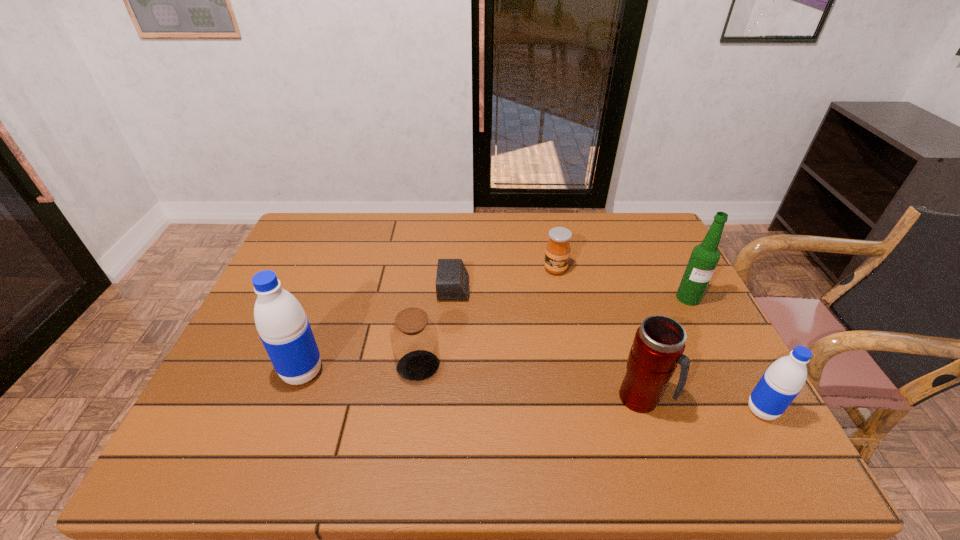
The width and height of the screenshot is (960, 540). What are the coordinates of `the left water bottle` in the screenshot? It's located at (284, 329).

Where is `the leftmost object`? Image resolution: width=960 pixels, height=540 pixels. the leftmost object is located at coordinates point(284,329).

This screenshot has width=960, height=540. Identify the location of the shorter water bottle. (780, 384).

Image resolution: width=960 pixels, height=540 pixels. I want to click on the nearer water bottle, so click(780, 384).

The width and height of the screenshot is (960, 540). What are the coordinates of `alarm clock` in the screenshot? It's located at (452, 280).

Where is `the sixth tallest object`? Image resolution: width=960 pixels, height=540 pixels. the sixth tallest object is located at coordinates (557, 253).

You are a GUI agent. You are given a task and a screenshot of the screen. Output one action in this format:
    pyautogui.click(x=<x>, y=<y>)
    Task: Click on the fourth object from right to left
    
    Given the screenshot: What is the action you would take?
    pyautogui.click(x=557, y=253)

I want to click on beer bottle, so click(x=704, y=258).

Identify the location of thermos bottle. Image resolution: width=960 pixels, height=540 pixels. (658, 346).

You are a GUI agent. You are given a task and a screenshot of the screen. Output one action in this format:
    pyautogui.click(x=<x>, y=<y>)
    Task: Click on the jar
    
    Given the screenshot: What is the action you would take?
    pyautogui.click(x=414, y=338)